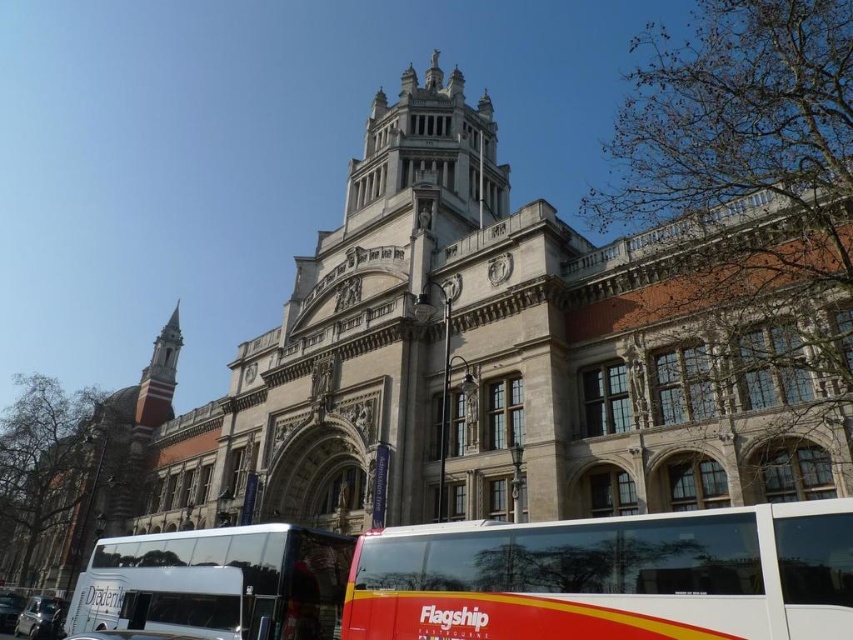
You are a pedestrian standing on the sidewalk in front of the grand historic building. You see the white glossy bus at center and the white glossy tour bus at lower left. Which bus is closer to you?

The white glossy tour bus at lower left is closer to you because the white glossy bus at center is located above it, meaning it is further away in the scene.

You are standing at the base of the historic building and want to walk to a point that is behind both point (791, 625) and point (114, 625). Is this possible?

No, because point (791, 625) is in front of point (114, 625), so there is no location that is behind both points simultaneously.

You are a pedestrian standing on the sidewalk and see the white glossy bus at center and the white glossy tour bus at lower left. Which bus is closer to the historic building?

The white glossy tour bus at lower left is closer to the historic building because the white glossy bus at center is positioned on the right side of it, meaning the tour bus is between the building and the other bus.